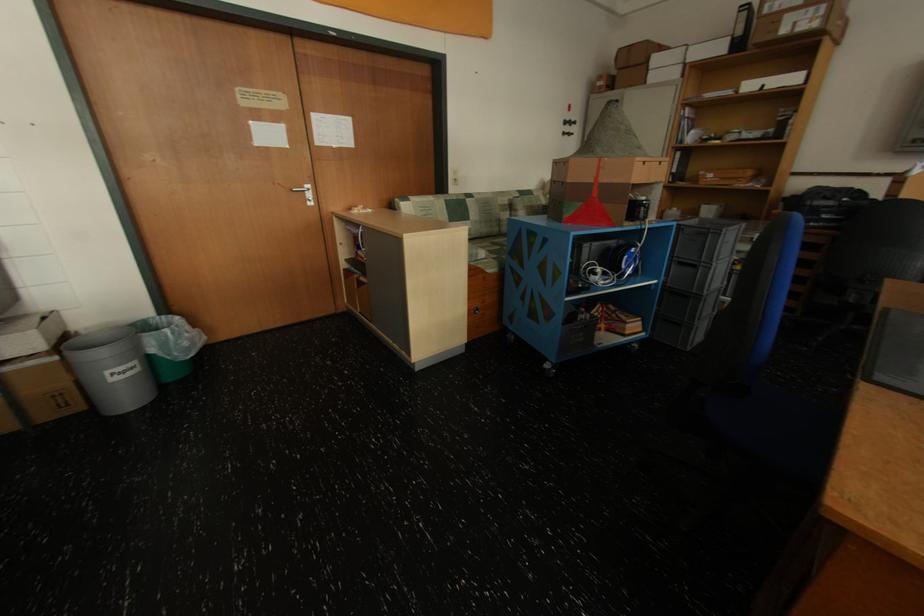
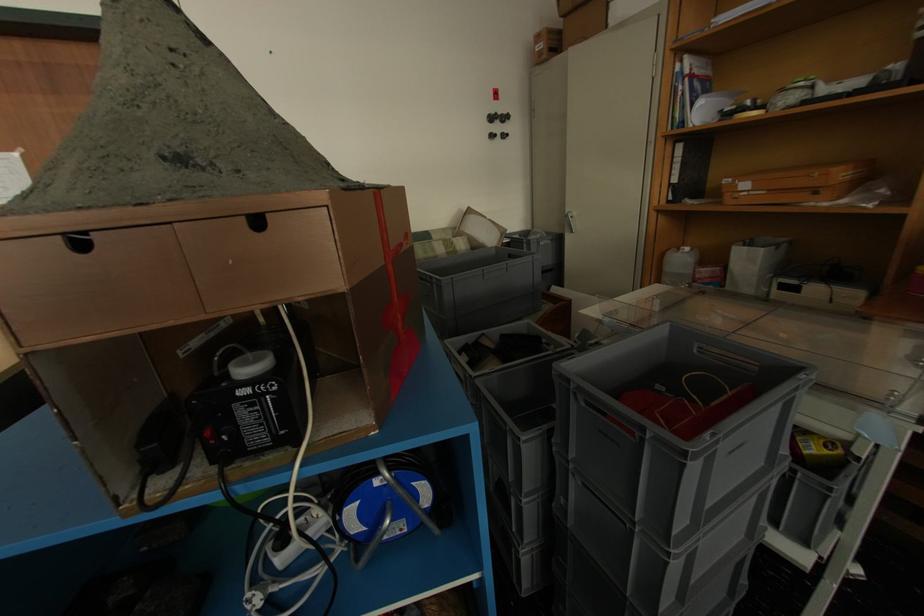
In a continuous first-person perspective shot, in which direction is the camera moving?

The cameraman moved toward right, forward.